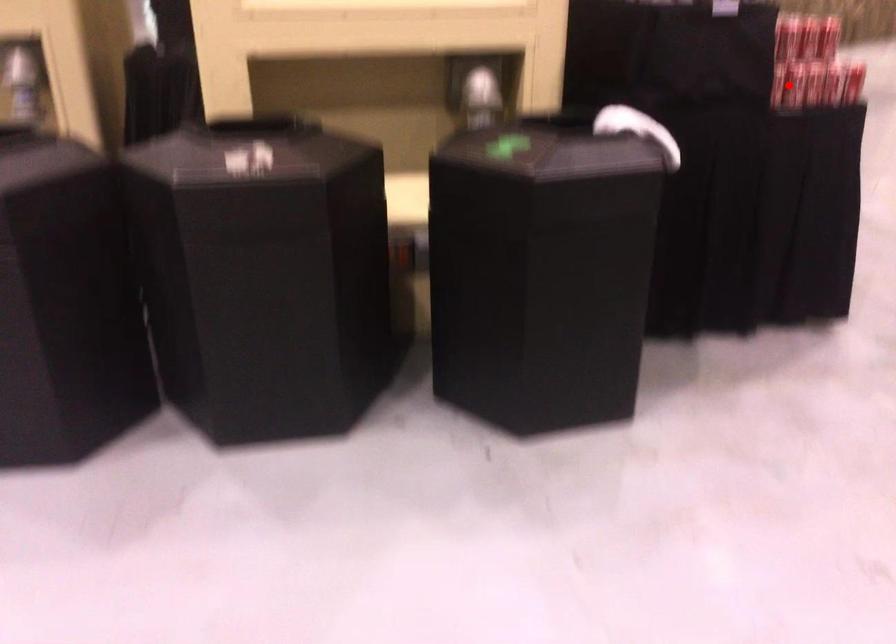
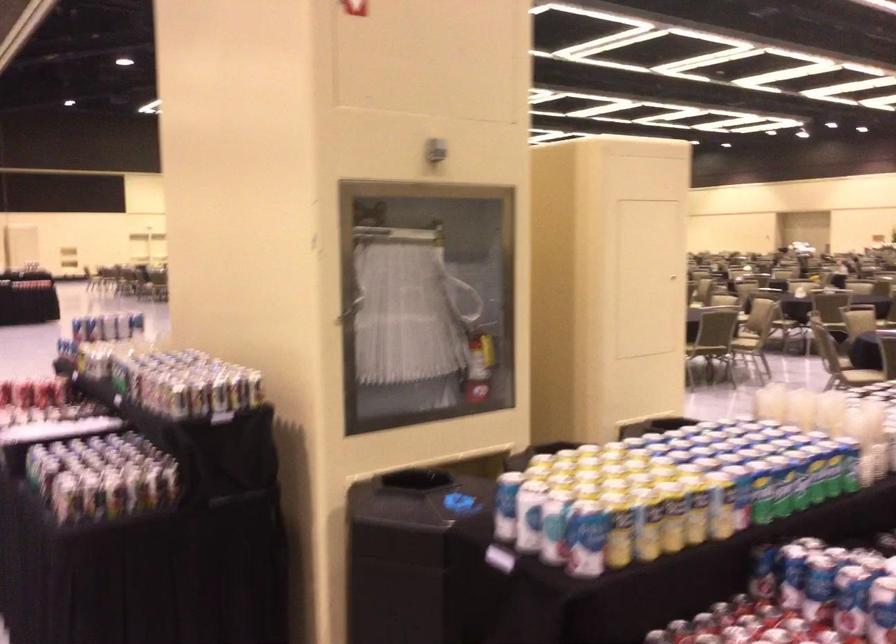
Question: I am providing you with two images of the same scene from different viewpoints. A red point is marked on the first image. Is the red point's position out of view in image 2?

Choices:
 (A) Yes
 (B) No

Answer: (A)